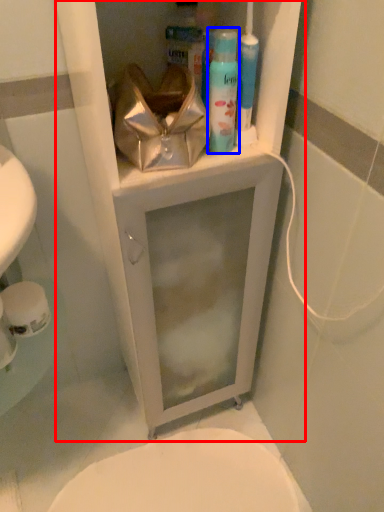
Question: Among these objects, which one is nearest to the camera, medicine cabinet (highlighted by a red box) or shaving cream (highlighted by a blue box)?

Choices:
 (A) medicine cabinet
 (B) shaving cream

Answer: (A)